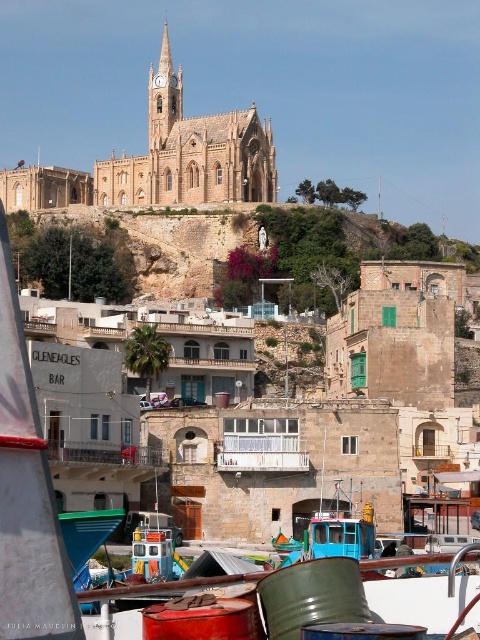
You are standing at the harbor and want to visit the beige stone church at upper center. If you start walking directly towards it, how far will you have to walk in meters?

The beige stone church at upper center is 160.91 meters away from the harbor, so you will have to walk 160.91 meters to reach it.

You are a tourist standing at the harbor looking towards the church. Which object is closer to you, the beige stone church at upper center or the brown stone hillside at center?

The beige stone church at upper center is closer to you because the brown stone hillside at center is behind it.

You are standing at the point with coordinates point (x=372, y=234) and want to look towards the church spire. Is the point point (x=61, y=180) blocking your view? Please explain your reasoning.

Point (x=61, y=180) is behind point (x=372, y=234), so it would not block your view of the church spire when standing at point (x=372, y=234).